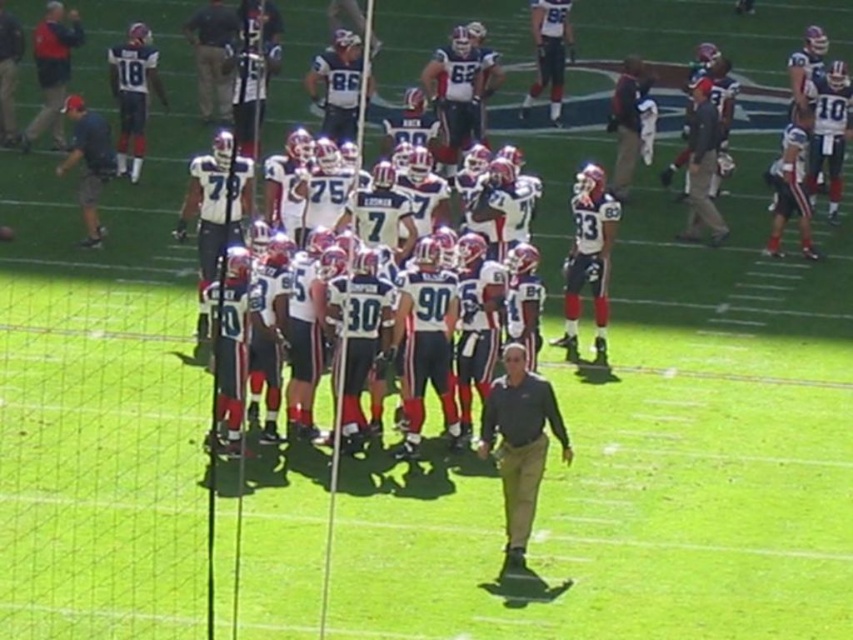
Question: Is dark green shirt at center further to the viewer compared to white matte uniform at center?

Choices:
 (A) yes
 (B) no

Answer: (B)

Question: Can you confirm if dark green shirt at center is positioned to the right of matte black jacket at upper left?

Choices:
 (A) no
 (B) yes

Answer: (B)

Question: Estimate the real-world distances between objects in this image. Which object is farther from the dark blue jacket at upper left?

Choices:
 (A) matte black jacket at upper left
 (B) dark green shirt at center
 (C) dark blue uniform at center

Answer: (B)

Question: Based on their relative distances, which object is farther from the matte black jacket at upper left?

Choices:
 (A) dark blue uniform at center
 (B) white matte uniform at center
 (C) dark gray jacket at center
 (D) dark blue jacket at upper left

Answer: (C)

Question: Can you confirm if dark blue jacket at upper left is wider than dark blue uniform at center?

Choices:
 (A) yes
 (B) no

Answer: (A)

Question: Which point is farther to the camera?

Choices:
 (A) dark gray jacket at center
 (B) dark green shirt at center
 (C) white matte uniform at center

Answer: (A)